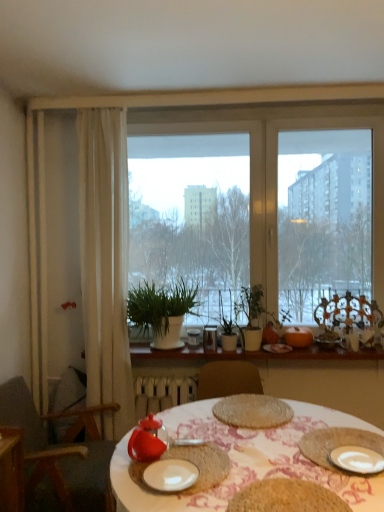
Find the location of a particular element. This screenshot has width=384, height=512. free space between white matte plate at center, which ranks as the 2th plate in right-to-left order, and transparent glass teapot at lower left, the fifth tableware in the right-to-left sequence is located at coordinates pyautogui.click(x=173, y=460).